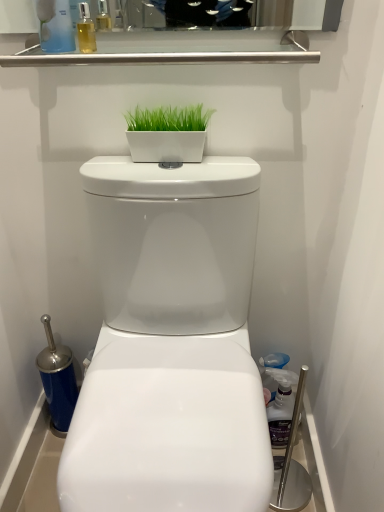
In order to face translucent plastic bottle at upper left, which is counted as the 2th cleaning product, starting from the back, should I rotate leftwards or rightwards?

Turn left approximately 18.619 degrees to face it.

The height and width of the screenshot is (512, 384). Describe the element at coordinates (55, 25) in the screenshot. I see `translucent plastic bottle at upper left, which is the 1th cleaning product in front-to-back order` at that location.

The height and width of the screenshot is (512, 384). Find the location of `white glossy toilet at center`. white glossy toilet at center is located at coordinates (171, 344).

This screenshot has height=512, width=384. I want to click on translucent plastic spray bottle at right, which ranks as the first cleaning product in right-to-left order, so click(281, 409).

Is translucent plastic bottle at upper left, placed as the 2th cleaning product when sorted from right to left, oriented towards translucent plastic spray bottle at right, the first cleaning product when ordered from back to front?

No, translucent plastic bottle at upper left, placed as the 2th cleaning product when sorted from right to left, is not oriented towards translucent plastic spray bottle at right, the first cleaning product when ordered from back to front.

In the scene shown: Considering the relative sizes of translucent plastic bottle at upper left, which appears as the first cleaning product when viewed from the top, and translucent plastic spray bottle at right, acting as the 1th cleaning product starting from the bottom, in the image provided, is translucent plastic bottle at upper left, which appears as the first cleaning product when viewed from the top, wider than translucent plastic spray bottle at right, acting as the 1th cleaning product starting from the bottom,?

Correct, the width of translucent plastic bottle at upper left, which appears as the first cleaning product when viewed from the top, exceeds that of translucent plastic spray bottle at right, acting as the 1th cleaning product starting from the bottom.

Which is correct: translucent plastic bottle at upper left, which appears as the first cleaning product when viewed from the top, is inside translucent plastic spray bottle at right, acting as the 1th cleaning product starting from the bottom, or outside of it?

translucent plastic bottle at upper left, which appears as the first cleaning product when viewed from the top, lies outside translucent plastic spray bottle at right, acting as the 1th cleaning product starting from the bottom.

Is white glossy toilet at center oriented towards green matte planter at center?

No, white glossy toilet at center is not aimed at green matte planter at center.

Could green matte planter at center be considered to be inside white glossy toilet at center?

No, green matte planter at center is located outside of white glossy toilet at center.

Is white glossy toilet at center touching green matte planter at center?

No, white glossy toilet at center is not with green matte planter at center.

Can you confirm if white glossy toilet at center is taller than green matte planter at center?

Yes.

Considering the relative positions of green matte planter at center and translucent plastic spray bottle at right, the first cleaning product when ordered from back to front, in the image provided, is green matte planter at center behind translucent plastic spray bottle at right, the first cleaning product when ordered from back to front,?

No, the depth of green matte planter at center is less than that of translucent plastic spray bottle at right, the first cleaning product when ordered from back to front.

Considering the relative sizes of green matte planter at center and translucent plastic spray bottle at right, the first cleaning product when ordered from back to front, in the image provided, is green matte planter at center shorter than translucent plastic spray bottle at right, the first cleaning product when ordered from back to front,?

Yes.

Between green matte planter at center and translucent plastic spray bottle at right, acting as the 2th cleaning product starting from the top, which one has larger size?

Bigger between the two is translucent plastic spray bottle at right, acting as the 2th cleaning product starting from the top.

Considering the sizes of objects translucent plastic spray bottle at right, marked as the 2th cleaning product in a left-to-right arrangement, and green matte planter at center in the image provided, who is smaller, translucent plastic spray bottle at right, marked as the 2th cleaning product in a left-to-right arrangement, or green matte planter at center?

green matte planter at center is smaller.

Where is `houseplant in front of the translucent plastic spray bottle at right, marked as the 2th cleaning product in a left-to-right arrangement`? The width and height of the screenshot is (384, 512). houseplant in front of the translucent plastic spray bottle at right, marked as the 2th cleaning product in a left-to-right arrangement is located at coordinates (167, 134).

From a real-world perspective, does translucent plastic spray bottle at right, which ranks as the second cleaning product in front-to-back order, sit lower than green matte planter at center?

Correct, in the physical world, translucent plastic spray bottle at right, which ranks as the second cleaning product in front-to-back order, is lower than green matte planter at center.

Between green matte planter at center and translucent plastic bottle at upper left, the second cleaning product ordered from the bottom, which one has smaller width?

With smaller width is green matte planter at center.

Is green matte planter at center to the right of translucent plastic bottle at upper left, the 1th cleaning product positioned from the left, from the viewer's perspective?

Yes.

From a real-world perspective, which is physically below, green matte planter at center or translucent plastic bottle at upper left, which appears as the first cleaning product when viewed from the top?

In real-world perspective, green matte planter at center is lower.

Is point (132, 124) closer to viewer compared to point (54, 48)?

No, (132, 124) is further to viewer.

Is white glossy toilet at center beside translucent plastic spray bottle at right, acting as the 2th cleaning product starting from the top?

white glossy toilet at center is not next to translucent plastic spray bottle at right, acting as the 2th cleaning product starting from the top, and they're not touching.

Is translucent plastic spray bottle at right, which ranks as the second cleaning product in front-to-back order, at the back of white glossy toilet at center?

white glossy toilet at center does not have its back to translucent plastic spray bottle at right, which ranks as the second cleaning product in front-to-back order.

Can we say white glossy toilet at center lies outside translucent plastic spray bottle at right, acting as the 2th cleaning product starting from the top?

white glossy toilet at center lies outside translucent plastic spray bottle at right, acting as the 2th cleaning product starting from the top,'s area.

Between white glossy toilet at center and translucent plastic spray bottle at right, which ranks as the second cleaning product in front-to-back order, which one appears on the left side from the viewer's perspective?

white glossy toilet at center.

Between translucent plastic spray bottle at right, marked as the 2th cleaning product in a left-to-right arrangement, and white glossy toilet at center, which one has less height?

With less height is translucent plastic spray bottle at right, marked as the 2th cleaning product in a left-to-right arrangement.

Looking at their sizes, would you say translucent plastic spray bottle at right, the first cleaning product when ordered from back to front, is wider or thinner than white glossy toilet at center?

translucent plastic spray bottle at right, the first cleaning product when ordered from back to front, is thinner than white glossy toilet at center.

From the image's perspective, is translucent plastic spray bottle at right, acting as the 2th cleaning product starting from the top, under white glossy toilet at center?

Yes.

Which is behind, translucent plastic spray bottle at right, which ranks as the second cleaning product in front-to-back order, or white glossy toilet at center?

translucent plastic spray bottle at right, which ranks as the second cleaning product in front-to-back order.

The width and height of the screenshot is (384, 512). In order to click on cleaning product above the translucent plastic spray bottle at right, acting as the 2th cleaning product starting from the top (from a real-world perspective) in this screenshot , I will do `click(55, 25)`.

This screenshot has width=384, height=512. In order to click on toilet that appears in front of the green matte planter at center in this screenshot , I will do `click(171, 344)`.

When comparing their distances from white glossy toilet at center, does green matte planter at center or translucent plastic spray bottle at right, which ranks as the first cleaning product in right-to-left order, seem closer?

green matte planter at center is closer to white glossy toilet at center.

Which object lies nearer to the anchor point green matte planter at center, translucent plastic spray bottle at right, marked as the 2th cleaning product in a left-to-right arrangement, or white glossy toilet at center?

white glossy toilet at center is closer to green matte planter at center.

Estimate the real-world distances between objects in this image. Which object is further from translucent plastic bottle at upper left, which is counted as the 2th cleaning product, starting from the back, translucent plastic spray bottle at right, which ranks as the first cleaning product in right-to-left order, or white glossy toilet at center?

translucent plastic spray bottle at right, which ranks as the first cleaning product in right-to-left order, is further to translucent plastic bottle at upper left, which is counted as the 2th cleaning product, starting from the back.

Looking at this image, estimate the real-world distances between objects in this image. Which object is further from green matte planter at center, translucent plastic bottle at upper left, the 1th cleaning product positioned from the left, or white glossy toilet at center?

The object further to green matte planter at center is white glossy toilet at center.

Which object lies nearer to the anchor point green matte planter at center, white glossy toilet at center or translucent plastic spray bottle at right, which ranks as the second cleaning product in front-to-back order?

The object closer to green matte planter at center is white glossy toilet at center.

Based on their spatial positions, is translucent plastic spray bottle at right, acting as the 2th cleaning product starting from the top, or green matte planter at center further from white glossy toilet at center?

Based on the image, translucent plastic spray bottle at right, acting as the 2th cleaning product starting from the top, appears to be further to white glossy toilet at center.

In the scene shown: Based on their spatial positions, is white glossy toilet at center or green matte planter at center further from translucent plastic spray bottle at right, the first cleaning product when ordered from back to front?

Among the two, green matte planter at center is located further to translucent plastic spray bottle at right, the first cleaning product when ordered from back to front.

From the image, which object appears to be nearer to white glossy toilet at center, translucent plastic spray bottle at right, acting as the 1th cleaning product starting from the bottom, or translucent plastic bottle at upper left, which appears as the first cleaning product when viewed from the top?

Among the two, translucent plastic spray bottle at right, acting as the 1th cleaning product starting from the bottom, is located nearer to white glossy toilet at center.

Where is `toilet that lies between green matte planter at center and translucent plastic spray bottle at right, acting as the 2th cleaning product starting from the top, from top to bottom`? toilet that lies between green matte planter at center and translucent plastic spray bottle at right, acting as the 2th cleaning product starting from the top, from top to bottom is located at coordinates (171, 344).

Where is `toilet that lies between translucent plastic bottle at upper left, the second cleaning product ordered from the bottom, and translucent plastic spray bottle at right, which ranks as the first cleaning product in right-to-left order, from top to bottom`? The height and width of the screenshot is (512, 384). toilet that lies between translucent plastic bottle at upper left, the second cleaning product ordered from the bottom, and translucent plastic spray bottle at right, which ranks as the first cleaning product in right-to-left order, from top to bottom is located at coordinates (171, 344).

Find the location of `houseplant between translucent plastic bottle at upper left, which appears as the first cleaning product when viewed from the top, and translucent plastic spray bottle at right, the first cleaning product when ordered from back to front, from top to bottom`. houseplant between translucent plastic bottle at upper left, which appears as the first cleaning product when viewed from the top, and translucent plastic spray bottle at right, the first cleaning product when ordered from back to front, from top to bottom is located at coordinates pyautogui.click(x=167, y=134).

This screenshot has width=384, height=512. I want to click on houseplant between translucent plastic bottle at upper left, which is the 1th cleaning product in front-to-back order, and white glossy toilet at center in the up-down direction, so click(x=167, y=134).